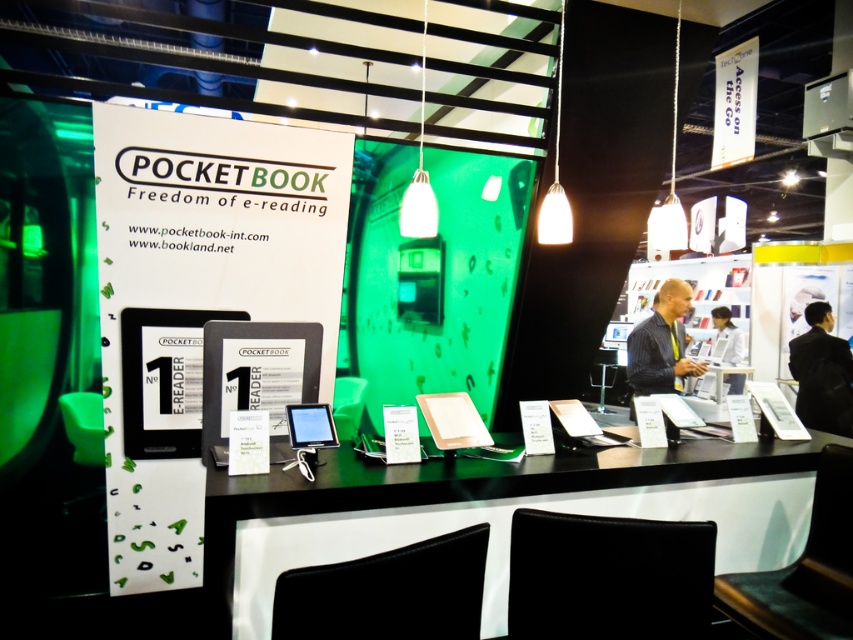
Who is more forward, (798,344) or (726,349)?

Positioned in front is point (798,344).

Between black leather jacket at right and white glossy laptop at center, which one has less height?

With less height is black leather jacket at right.

Is point (833, 355) positioned before point (743, 374)?

That is True.

Where is `black leather jacket at right`? This screenshot has width=853, height=640. black leather jacket at right is located at coordinates (822, 372).

Is striped shirt at center to the right of white glossy laptop at center from the viewer's perspective?

In fact, striped shirt at center is to the left of white glossy laptop at center.

Does point (672, 333) come farther from viewer compared to point (723, 333)?

No.

Find the location of a particular element. The image size is (853, 640). striped shirt at center is located at coordinates (660, 344).

Is point (828, 394) farther from viewer compared to point (695, 374)?

Yes, it is behind point (695, 374).

Is black leather jacket at right to the left of striped shirt at center from the viewer's perspective?

In fact, black leather jacket at right is to the right of striped shirt at center.

Is point (822, 337) positioned behind point (654, 320)?

Yes, point (822, 337) is farther from viewer.

Find the location of `black leather jacket at right`. black leather jacket at right is located at coordinates (822, 372).